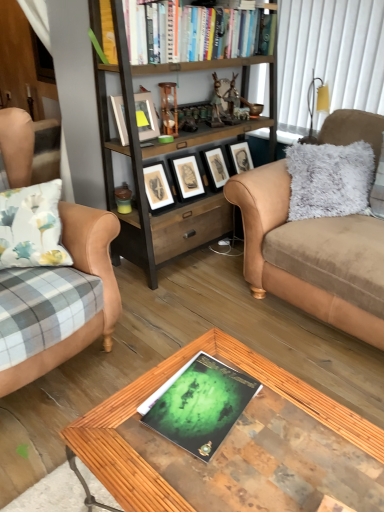
At what (x,y) coordinates should I click in order to perform the action: click on free space in front of green matte magazine at center. Please return your answer as a coordinate pair (x, y). Looking at the image, I should click on (213, 475).